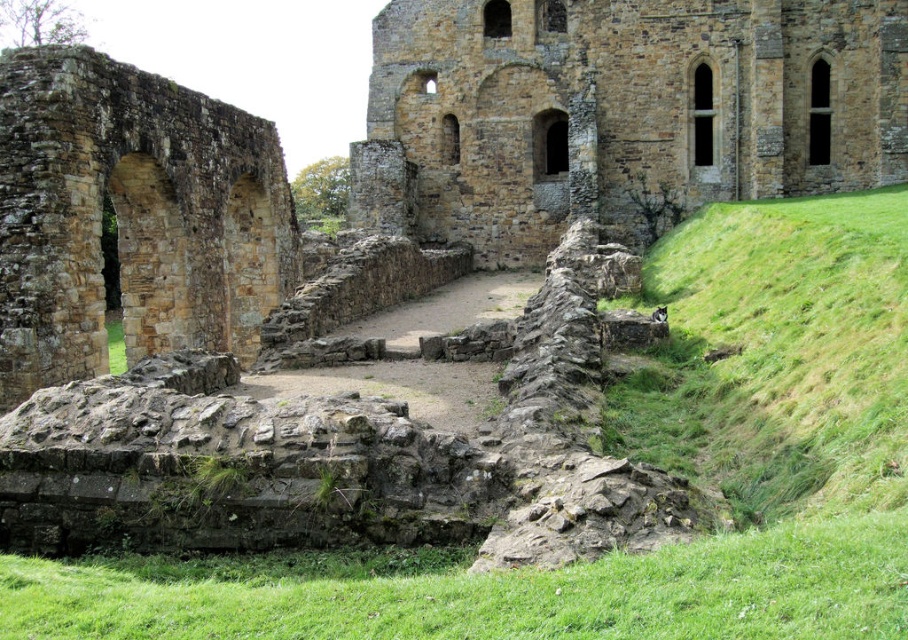
Question: Which point is farther from the camera taking this photo?

Choices:
 (A) (164, 230)
 (B) (559, 132)

Answer: (B)

Question: Which point appears closest to the camera in this image?

Choices:
 (A) (618, 67)
 (B) (125, 144)

Answer: (B)

Question: Can you confirm if brown stone wall at center is thinner than brown stone arch at left?

Choices:
 (A) yes
 (B) no

Answer: (B)

Question: Can you confirm if brown stone wall at center is positioned to the right of brown stone arch at left?

Choices:
 (A) yes
 (B) no

Answer: (A)

Question: Is brown stone wall at center bigger than brown stone arch at left?

Choices:
 (A) yes
 (B) no

Answer: (A)